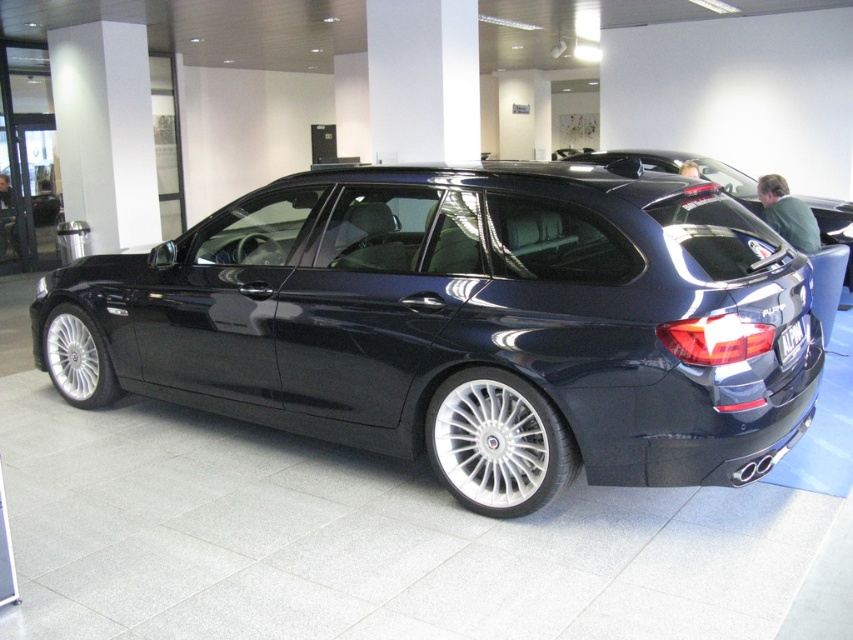
Question: Which object is closer to the camera taking this photo?

Choices:
 (A) black plastic license plate at rear
 (B) glossy dark blue wagon at center

Answer: (B)

Question: Which point is closer to the camera?

Choices:
 (A) (799, 333)
 (B) (827, 236)

Answer: (A)

Question: Estimate the real-world distances between objects in this image. Which object is farther from the glossy dark blue wagon at center?

Choices:
 (A) black plastic license plate at rear
 (B) glossy black car at center

Answer: (B)

Question: Is glossy black car at center below black plastic license plate at rear?

Choices:
 (A) yes
 (B) no

Answer: (B)

Question: Can you confirm if glossy dark blue wagon at center is positioned to the left of glossy black car at center?

Choices:
 (A) yes
 (B) no

Answer: (A)

Question: Can you confirm if glossy dark blue wagon at center is smaller than black plastic license plate at rear?

Choices:
 (A) yes
 (B) no

Answer: (B)